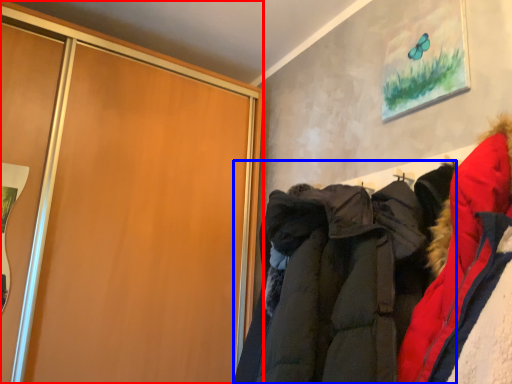
Question: Which point is further to the camera, cupboard (highlighted by a red box) or jacket (highlighted by a blue box)?

Choices:
 (A) cupboard
 (B) jacket

Answer: (A)